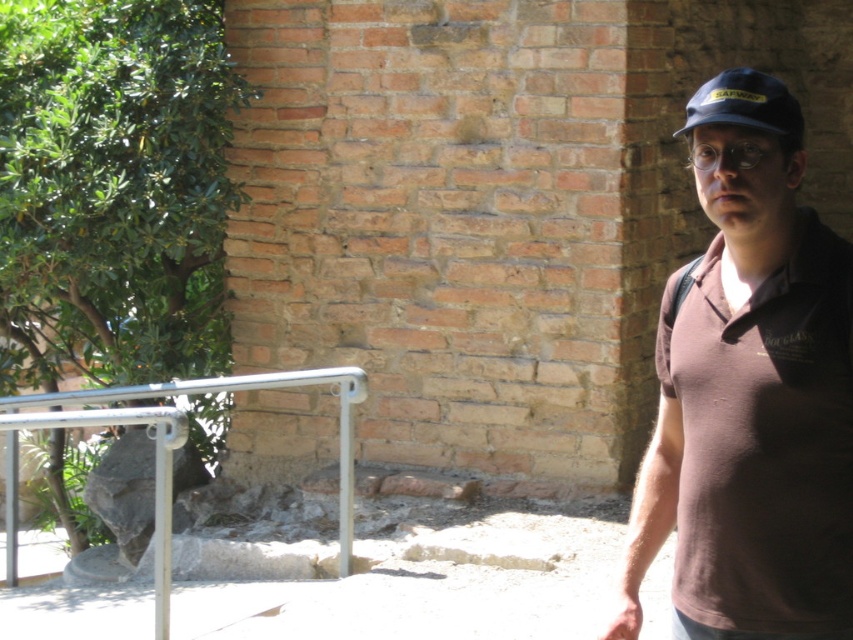
You are a photographer setting up a shot of the man in the image. You need to ensure both the brown cotton shirt at right and the silver metallic rail at lower left are in focus. Which object should you focus on first to make sure both are sharp?

You should focus on the brown cotton shirt at right first because it is closer to the viewer, so focusing there will ensure the silver metallic rail at lower left, which is farther away, is also in focus.

You are a delivery person carrying a box that requires a 3.5 meter clearance to maneuver safely. You see the brown cotton shirt at right and the silver metallic rail at lower left in the scene. Can you safely navigate between them with your box?

The brown cotton shirt at right is 3.01 meters away from the silver metallic rail at lower left. Since the required clearance is 3.5 meters, the distance is insufficient. You cannot safely navigate between them with the box.

You are a photographer setting up a shot of the man and the wall. You need to ensure that the silver metallic rail at lower left and the blue fabric baseball cap at upper right are both in frame. Which object is wider and might require more space horizontally?

The silver metallic rail at lower left might be wider than the blue fabric baseball cap at upper right, so it requires more horizontal space in the frame.